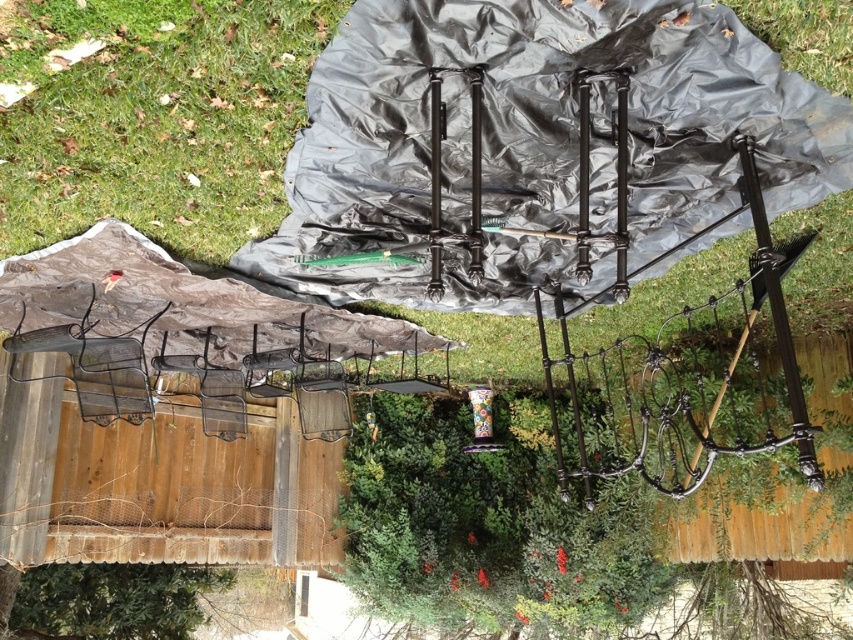
Is point (329, 84) farther from camera compared to point (93, 212)?

No, (329, 84) is in front of (93, 212).

Is point (291, 230) less distant than point (325, 40)?

That is False.

Image resolution: width=853 pixels, height=640 pixels. I want to click on black plastic blanket at center, so click(x=537, y=141).